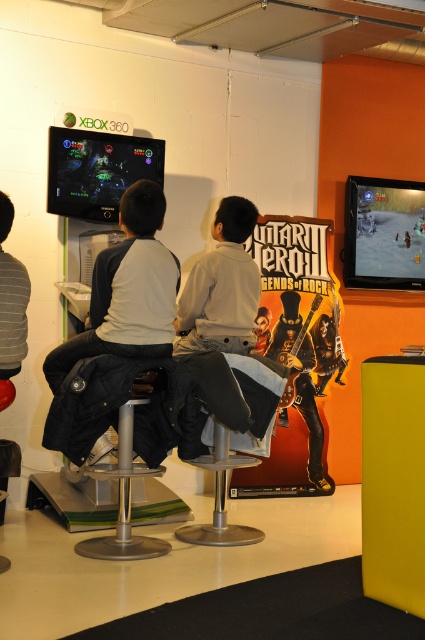
You are a technician who needs to adjust the position of the shiny black monitor at upper left. According to the coordinates provided, where exactly should you place it?

The shiny black monitor at upper left should be placed at point 0.267 on the x axis and 0.231 on the y axis.

You are standing in the gaming area and want to place a small decoration between the two points, point 1 at point (132, 296) and point 2 at point (215, 500). Which point should the decoration be closer to if you want it to appear larger in the camera view?

The decoration should be placed closer to point (132, 296) because it is closer to the camera than point (215, 500), so objects placed there will appear larger in the camera view.

You are a photographer trying to capture a photo of both the dark gray fabric jacket at left and the shiny black monitor at upper left in the scene. Based on their heights, which object should you focus on first to ensure both are in frame?

The dark gray fabric jacket at left is much taller than the shiny black monitor at upper left, so you should focus on the dark gray fabric jacket at left first to ensure both are in frame.